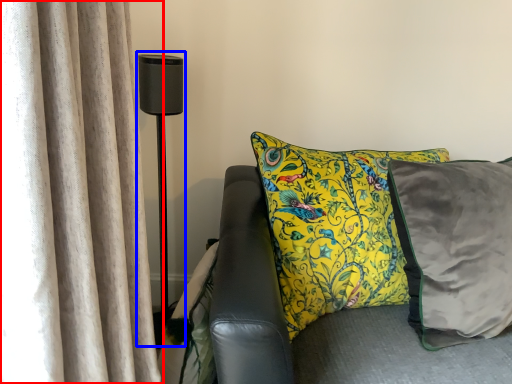
Question: Which object appears closest to the camera in this image, curtain (highlighted by a red box) or table lamp (highlighted by a blue box)?

Choices:
 (A) curtain
 (B) table lamp

Answer: (A)